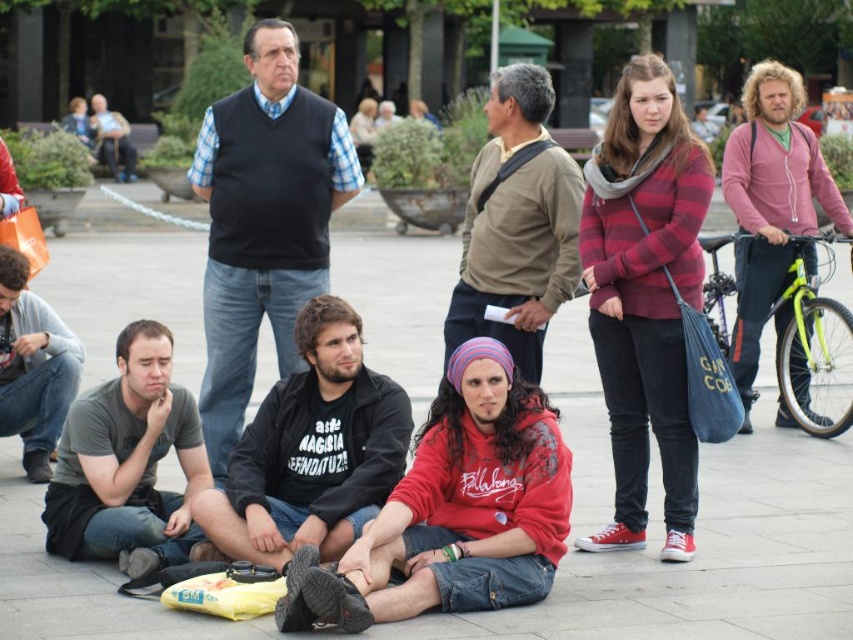
You are a photographer trying to capture a group photo of the red fleece at center and the black cotton jacket at center. Since you want to ensure both subjects are visible, which direction should you position yourself relative to the subjects to avoid blocking either of them?

You should position yourself to the left side of the black cotton jacket at center and the red fleece at center because the red fleece at center is on the right side of the black cotton jacket at center, so standing to the left would allow you to see both without obstruction.

In the scene shown: You are a photographer standing in the public square and want to take a photo of both the dark blue sweater at center and the black cotton jacket at center. Which one should you focus on first to ensure both are in the frame?

You should focus on the dark blue sweater at center first because it is closer to you than the black cotton jacket at center, ensuring both are in the frame.